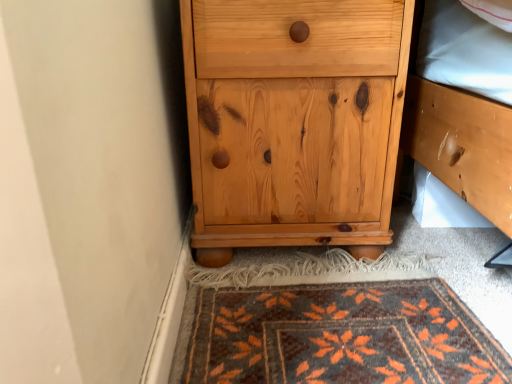
This screenshot has width=512, height=384. Describe the element at coordinates (336, 336) in the screenshot. I see `dark brown woven rug at lower center` at that location.

Measure the distance between point [373,340] and camera.

Point [373,340] is 26.93 inches from camera.

I want to click on dark brown woven rug at lower center, so click(x=336, y=336).

In order to click on natural wood chest of drawers at lower center in this screenshot , I will do `click(294, 122)`.

Describe the element at coordinates (294, 122) in the screenshot. I see `natural wood chest of drawers at lower center` at that location.

Image resolution: width=512 pixels, height=384 pixels. I want to click on dark brown woven rug at lower center, so click(336, 336).

Would you say dark brown woven rug at lower center is to the left or to the right of natural wood chest of drawers at lower center in the picture?

dark brown woven rug at lower center is to the right of natural wood chest of drawers at lower center.

Relative to natural wood chest of drawers at lower center, is dark brown woven rug at lower center in front or behind?

dark brown woven rug at lower center is positioned closer to the viewer than natural wood chest of drawers at lower center.

Based on the photo, which is closer to the camera, (328, 320) or (301, 6)?

Point (328, 320) is farther from the camera than point (301, 6).

From the image's perspective, is dark brown woven rug at lower center beneath natural wood chest of drawers at lower center?

Yes, from the image's perspective, dark brown woven rug at lower center is beneath natural wood chest of drawers at lower center.

From a real-world perspective, relative to natural wood chest of drawers at lower center, is dark brown woven rug at lower center vertically above or below?

In terms of real-world spatial position, dark brown woven rug at lower center is below natural wood chest of drawers at lower center.

Is dark brown woven rug at lower center wider or thinner than natural wood chest of drawers at lower center?

dark brown woven rug at lower center is wider than natural wood chest of drawers at lower center.

Between dark brown woven rug at lower center and natural wood chest of drawers at lower center, which one has more height?

natural wood chest of drawers at lower center is taller.

Consider the image. Does dark brown woven rug at lower center have a larger size compared to natural wood chest of drawers at lower center?

No, dark brown woven rug at lower center is not bigger than natural wood chest of drawers at lower center.

Do you think dark brown woven rug at lower center is within natural wood chest of drawers at lower center, or outside of it?

dark brown woven rug at lower center is located beyond the bounds of natural wood chest of drawers at lower center.

Would you consider dark brown woven rug at lower center to be distant from natural wood chest of drawers at lower center?

No, dark brown woven rug at lower center is not far from natural wood chest of drawers at lower center.

From the picture: Does dark brown woven rug at lower center turn towards natural wood chest of drawers at lower center?

No, dark brown woven rug at lower center is not aimed at natural wood chest of drawers at lower center.

Can you tell me how much dark brown woven rug at lower center and natural wood chest of drawers at lower center differ in facing direction?

The angle between the facing direction of dark brown woven rug at lower center and the facing direction of natural wood chest of drawers at lower center is 0.891 degrees.

I want to click on mat in front of the natural wood chest of drawers at lower center, so click(336, 336).

Does natural wood chest of drawers at lower center appear on the left side of dark brown woven rug at lower center?

Correct, you'll find natural wood chest of drawers at lower center to the left of dark brown woven rug at lower center.

In the scene shown: Who is more distant, natural wood chest of drawers at lower center or dark brown woven rug at lower center?

natural wood chest of drawers at lower center is more distant.

Between point (221, 203) and point (451, 305), which one is positioned behind?

The point (221, 203) is more distant.

From the image's perspective, would you say natural wood chest of drawers at lower center is shown under dark brown woven rug at lower center?

Incorrect, from the image's perspective, natural wood chest of drawers at lower center is higher than dark brown woven rug at lower center.

From a real-world perspective, who is located higher, natural wood chest of drawers at lower center or dark brown woven rug at lower center?

From a 3D spatial view, natural wood chest of drawers at lower center is above.

Can you confirm if natural wood chest of drawers at lower center is thinner than dark brown woven rug at lower center?

Yes, natural wood chest of drawers at lower center is thinner than dark brown woven rug at lower center.

From their relative heights in the image, would you say natural wood chest of drawers at lower center is taller or shorter than dark brown woven rug at lower center?

In the image, natural wood chest of drawers at lower center appears to be taller than dark brown woven rug at lower center.

Considering the sizes of objects natural wood chest of drawers at lower center and dark brown woven rug at lower center in the image provided, who is smaller, natural wood chest of drawers at lower center or dark brown woven rug at lower center?

With smaller size is dark brown woven rug at lower center.

Is natural wood chest of drawers at lower center positioned beyond the bounds of dark brown woven rug at lower center?

Yes.

Is natural wood chest of drawers at lower center with dark brown woven rug at lower center?

No, natural wood chest of drawers at lower center is not making contact with dark brown woven rug at lower center.

Is natural wood chest of drawers at lower center oriented away from dark brown woven rug at lower center?

natural wood chest of drawers at lower center does not have its back to dark brown woven rug at lower center.

Where is `mat lying below the natural wood chest of drawers at lower center (from the image's perspective)`? The width and height of the screenshot is (512, 384). mat lying below the natural wood chest of drawers at lower center (from the image's perspective) is located at coordinates (336, 336).

I want to click on chest of drawers on the left of dark brown woven rug at lower center, so click(294, 122).

Where is `mat directly beneath the natural wood chest of drawers at lower center (from a real-world perspective)`? The image size is (512, 384). mat directly beneath the natural wood chest of drawers at lower center (from a real-world perspective) is located at coordinates (336, 336).